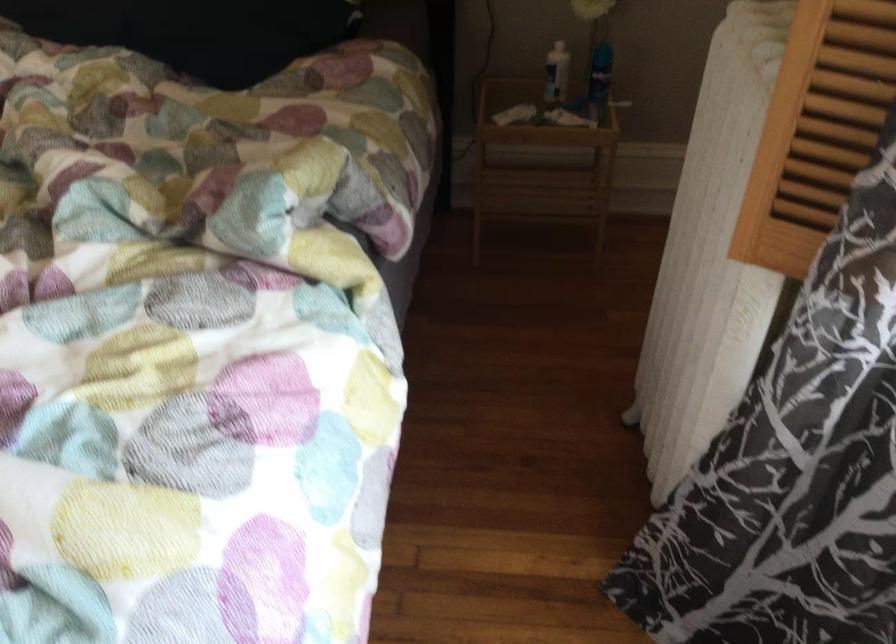
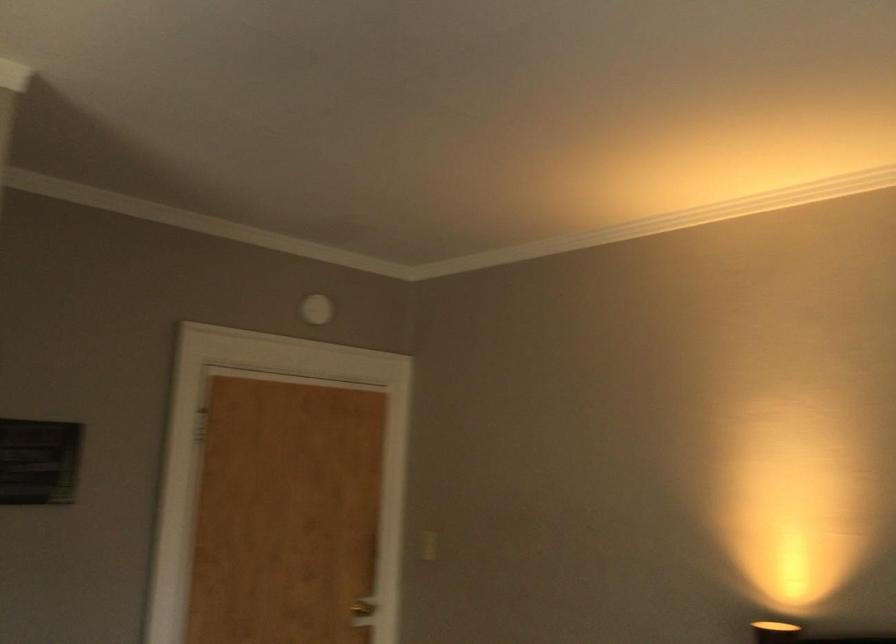
The first image is from the beginning of the video and the second image is from the end. How did the camera likely rotate when shooting the video?

The camera's rotation is toward left-up.